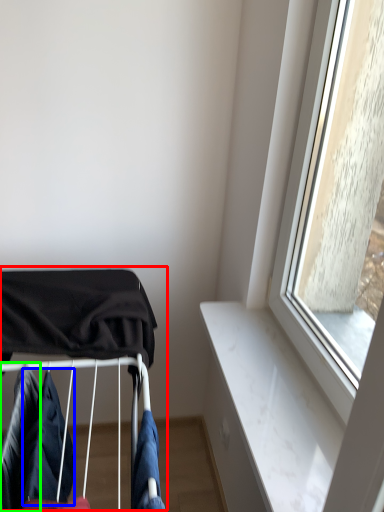
Question: Based on their relative distances, which object is farther from baby carriage (highlighted by a red box)? Choose from clothing (highlighted by a blue box) and clothing (highlighted by a green box).

Choices:
 (A) clothing
 (B) clothing

Answer: (B)